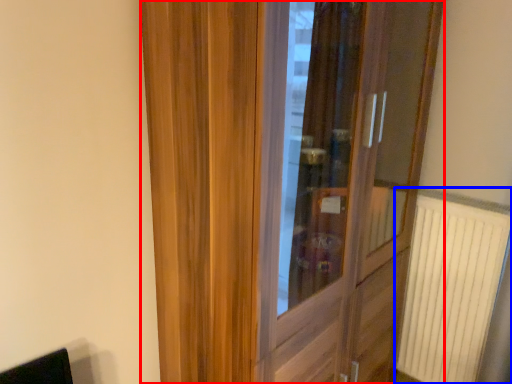
Question: Which point is further to the camera, door (highlighted by a red box) or radiator (highlighted by a blue box)?

Choices:
 (A) door
 (B) radiator

Answer: (B)